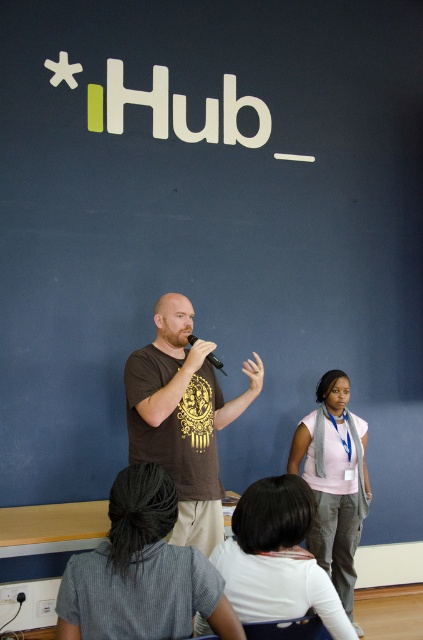
You are an event organizer who needs to ensure that the white matte shirt at lower center and the black matte microphone at center are visible to the audience. Based on their sizes, which object might require a closer camera angle for better visibility?

The white matte shirt at lower center is wider than the black matte microphone at center, so the microphone might need a closer camera angle to ensure visibility since it is narrower.